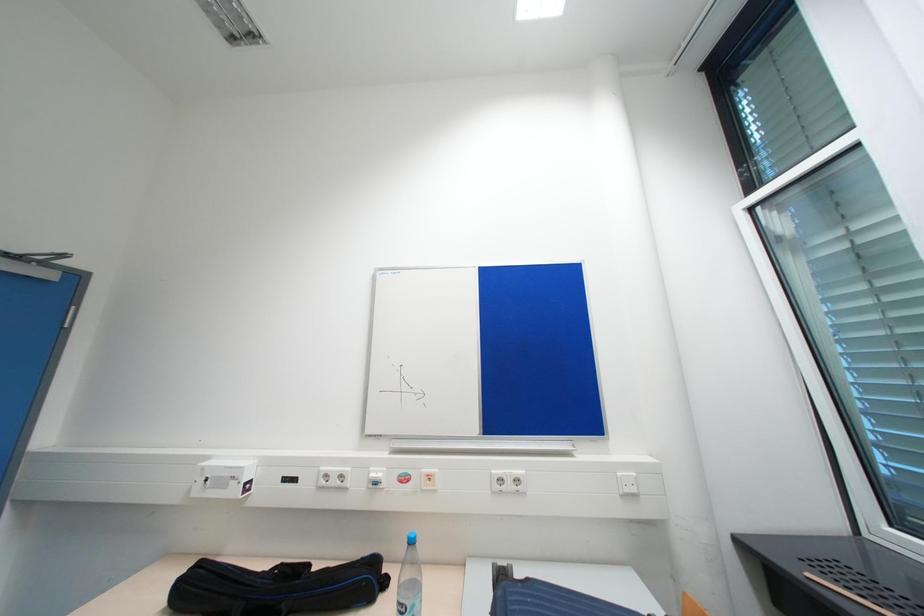
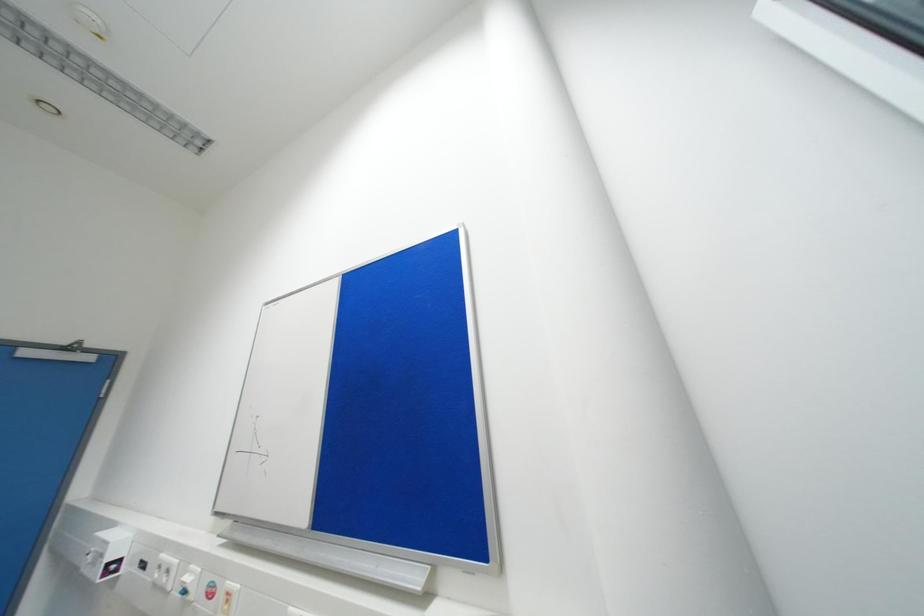
In a continuous first-person perspective shot, in which direction is the camera moving?

The cameraman walked toward right, forward.